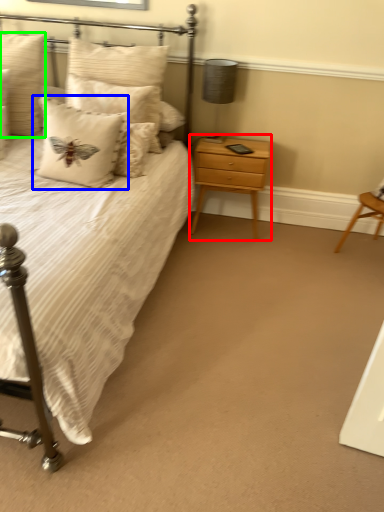
Question: Estimate the real-world distances between objects in this image. Which object is closer to nightstand (highlighted by a red box), pillow (highlighted by a blue box) or pillow (highlighted by a green box)?

Choices:
 (A) pillow
 (B) pillow

Answer: (A)